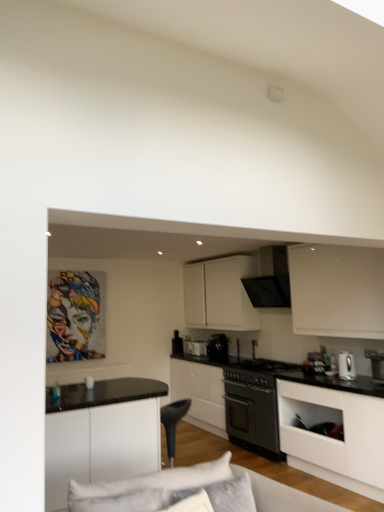
Question: Should I look upward or downward to see white matte cabinet at upper center, marked as the 3th cabinetry in a front-to-back arrangement?

Choices:
 (A) up
 (B) down

Answer: (B)

Question: Is black matte oven at center, which is the second appliance from front to back, to the right of white matte cabinet at lower right, positioned as the 1th cabinetry in front-to-back order, from the viewer's perspective?

Choices:
 (A) yes
 (B) no

Answer: (B)

Question: Considering the relative sizes of black matte oven at center, arranged as the 4th appliance when viewed from the back, and white matte cabinet at lower right, positioned as the 1th cabinetry in front-to-back order, in the image provided, is black matte oven at center, arranged as the 4th appliance when viewed from the back, taller than white matte cabinet at lower right, positioned as the 1th cabinetry in front-to-back order,?

Choices:
 (A) no
 (B) yes

Answer: (A)

Question: From a real-world perspective, is black matte oven at center, positioned as the 4th appliance in left-to-right order, positioned under white matte cabinet at lower right, which appears as the 3th cabinetry when viewed from the back, based on gravity?

Choices:
 (A) yes
 (B) no

Answer: (B)

Question: Is black matte oven at center, which is the second appliance from front to back, wider than white matte cabinet at lower right, positioned as the 1th cabinetry in front-to-back order?

Choices:
 (A) yes
 (B) no

Answer: (A)

Question: Is black matte oven at center, placed as the second appliance when sorted from right to left, located outside white matte cabinet at lower right, positioned as the 1th cabinetry in front-to-back order?

Choices:
 (A) yes
 (B) no

Answer: (A)

Question: From the image's perspective, is black matte oven at center, placed as the second appliance when sorted from right to left, located above white matte cabinet at lower right, positioned as the 1th cabinetry in front-to-back order?

Choices:
 (A) no
 (B) yes

Answer: (B)

Question: Does white glossy electric kettle at right touch black matte oven at center, which ranks as the 2th cabinetry in front-to-back order?

Choices:
 (A) yes
 (B) no

Answer: (B)

Question: Is white glossy electric kettle at right to the right of black matte oven at center, the second cabinetry in the back-to-front sequence, from the viewer's perspective?

Choices:
 (A) yes
 (B) no

Answer: (A)

Question: Is white glossy electric kettle at right positioned behind black matte oven at center, the second cabinetry in the back-to-front sequence?

Choices:
 (A) yes
 (B) no

Answer: (B)

Question: From a real-world perspective, is white glossy electric kettle at right located beneath black matte oven at center, the second cabinetry in the back-to-front sequence?

Choices:
 (A) no
 (B) yes

Answer: (A)

Question: Can you confirm if white glossy electric kettle at right is positioned to the left of black matte oven at center, the second cabinetry in the back-to-front sequence?

Choices:
 (A) no
 (B) yes

Answer: (A)

Question: From a real-world perspective, does white glossy electric kettle at right stand above black matte oven at center, the second cabinetry in the back-to-front sequence?

Choices:
 (A) no
 (B) yes

Answer: (B)

Question: Can white glossy toaster at center, acting as the first appliance starting from the left, be found inside white matte cabinet at upper center, marked as the 3th cabinetry in a front-to-back arrangement?

Choices:
 (A) no
 (B) yes

Answer: (A)